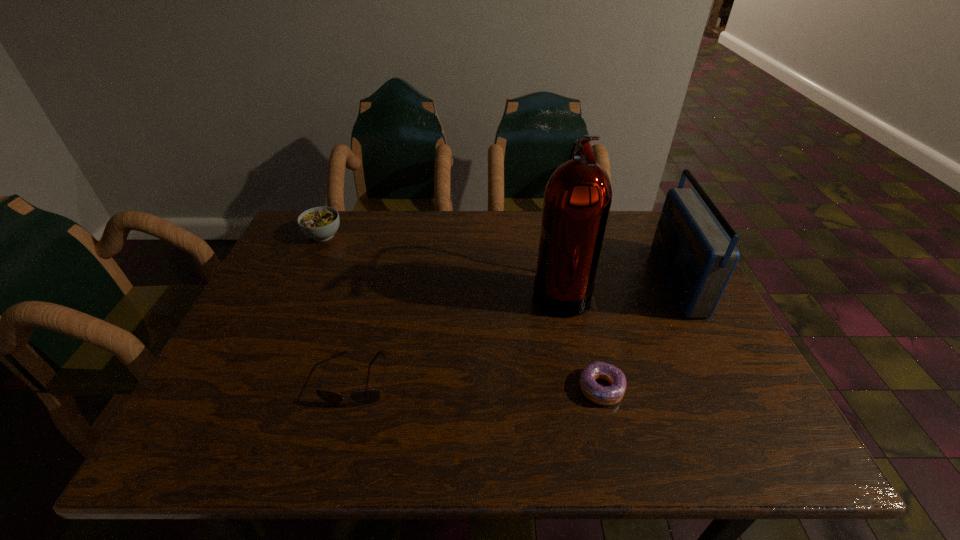
The image size is (960, 540). I want to click on free space at the near right corner, so click(x=712, y=430).

Locate an element on the screen. empty space between the tallest object and the doughnut is located at coordinates (581, 339).

The image size is (960, 540). In order to click on vacant area that lies between the soup bowl and the doughnut in this screenshot , I will do `click(462, 312)`.

At what (x,y) coordinates should I click in order to perform the action: click on free area in between the doughnut and the fire extinguisher. Please return your answer as a coordinate pair (x, y). This screenshot has width=960, height=540. Looking at the image, I should click on (581, 339).

This screenshot has height=540, width=960. Find the location of `vacant region between the fire extinguisher and the sunglasses`. vacant region between the fire extinguisher and the sunglasses is located at coordinates (459, 334).

Where is `free space between the rightmost object and the fire extinguisher`? This screenshot has width=960, height=540. free space between the rightmost object and the fire extinguisher is located at coordinates (617, 285).

Identify the location of empty space between the shortest object and the fire extinguisher. (581, 339).

Identify the location of free space that is in between the doughnut and the second tallest object. (638, 334).

Where is `unoccupied area between the doughnut and the fire extinguisher`? unoccupied area between the doughnut and the fire extinguisher is located at coordinates (581, 339).

Find the location of `vacant area that lies between the second tallest object and the third shortest object`. vacant area that lies between the second tallest object and the third shortest object is located at coordinates (499, 258).